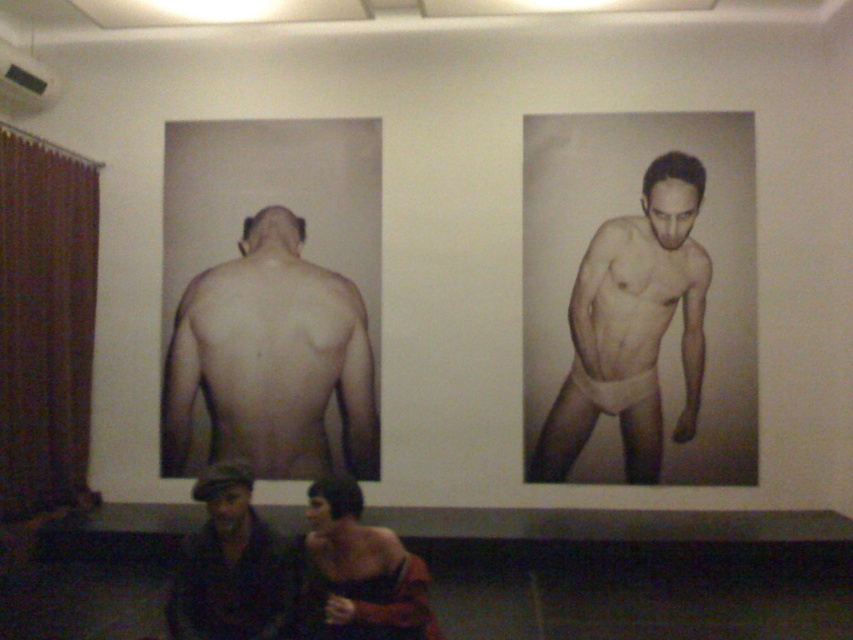
Consider the image. You are a photographer trying to capture a closeup of the smooth skin back at center without including the dark brown leather jacket at lower left in the frame. Based on their sizes, is this possible?

The smooth skin back at center is wider than the dark brown leather jacket at lower left, so it might be challenging to frame the smooth skin back at center without including the dark brown leather jacket at lower left if they are positioned closely together. However, adjusting the camera angle or zoom could help isolate the subject.

You are a photographer trying to capture a candid shot of the smooth skin man at lower center without making him aware. Since the smooth skin back at center is part of an exhibition, can you position yourself behind the photographs to take the shot?

The smooth skin back at center is located above the smooth skin man at lower center, so positioning yourself behind the photographs would allow you to take a candid shot of the smooth skin man at lower center without him noticing.